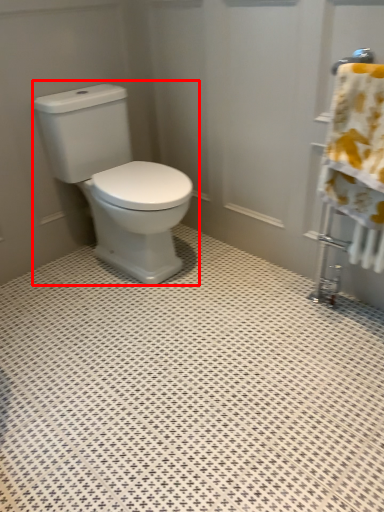
Question: Considering the relative positions of toilet (annotated by the red box) and bath towel in the image provided, where is toilet (annotated by the red box) located with respect to the staircase?

Choices:
 (A) right
 (B) left

Answer: (B)